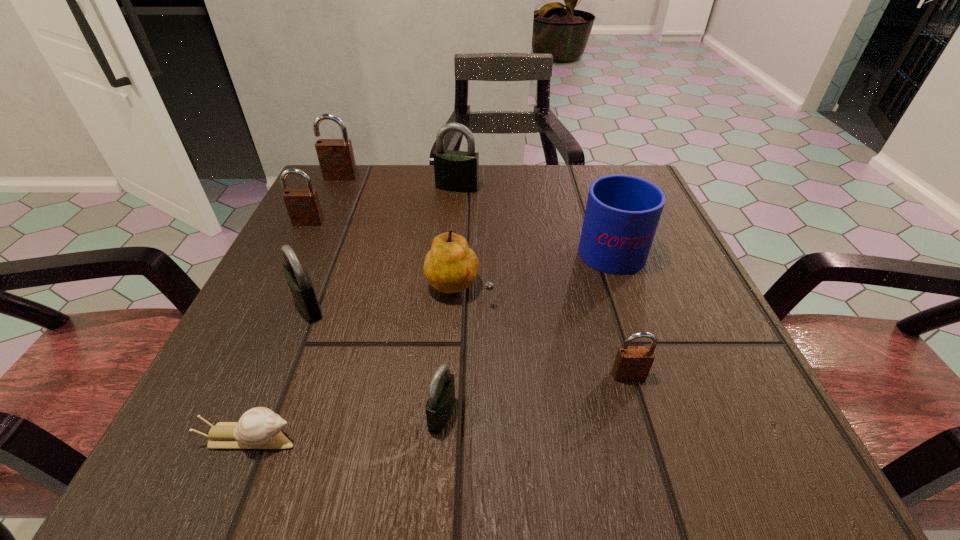
Image resolution: width=960 pixels, height=540 pixels. Identify the location of the nearest brown padlock. (632, 363).

What are the coordinates of `the rightmost padlock` in the screenshot? It's located at (632, 363).

Locate an element on the screen. The image size is (960, 540). the nearest black padlock is located at coordinates (441, 396).

The image size is (960, 540). In order to click on the smallest black padlock in this screenshot , I will do `click(441, 396)`.

I want to click on the shortest object, so click(x=258, y=428).

Locate an element on the screen. This screenshot has height=540, width=960. vacant space located 0.360m on the right of the eighth nearest object is located at coordinates (639, 187).

Identify the location of vacant space located 0.150m on the front-facing side of the farthest object. The image size is (960, 540). (322, 218).

Locate an element on the screen. This screenshot has height=540, width=960. vacant space positioned 0.120m on the side with the handle of the mug is located at coordinates (589, 188).

Locate an element on the screen. blank area located 0.060m on the side with the handle of the mug is located at coordinates (594, 203).

This screenshot has width=960, height=540. In order to click on vacant space located on the side with the handle of the mug in this screenshot , I will do [588, 186].